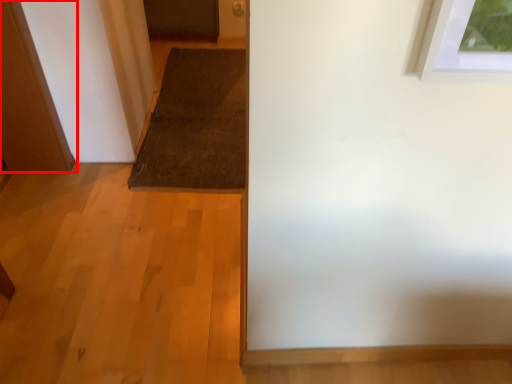
Question: In this image, where is door (annotated by the red box) located relative to doormat?

Choices:
 (A) right
 (B) left

Answer: (B)